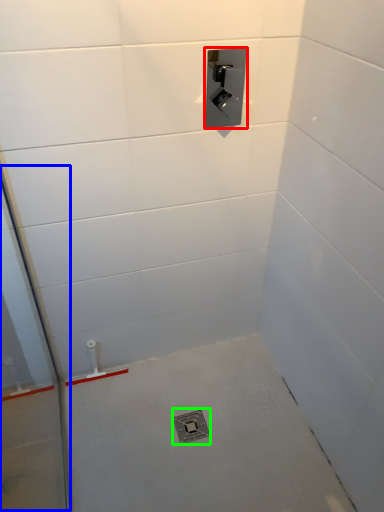
Question: Which object is positioned farthest from plumbing fixture (highlighted by a red box)? Select from glass door (highlighted by a blue box) and drain (highlighted by a green box).

Choices:
 (A) glass door
 (B) drain

Answer: (B)